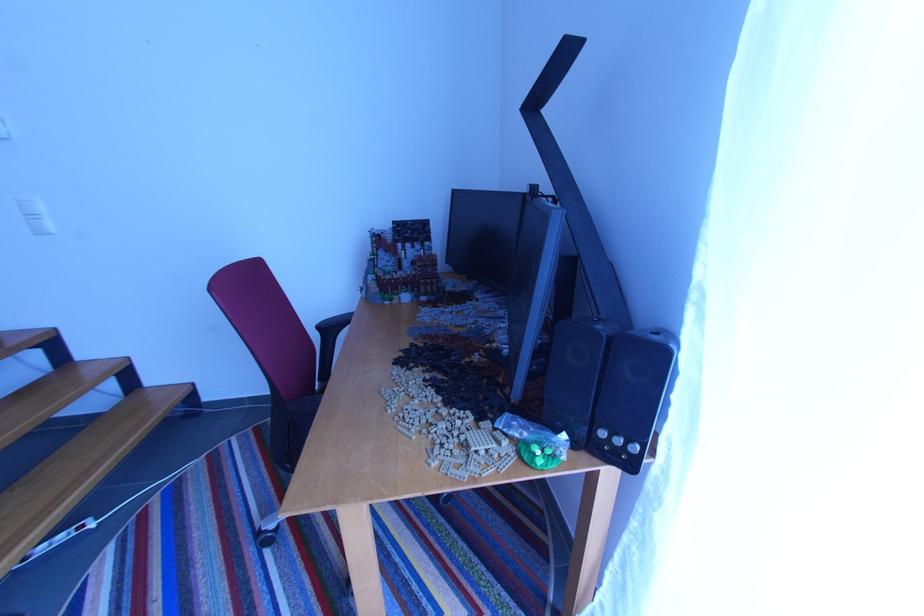
Locate an element on the screen. white light switch is located at coordinates click(35, 217).